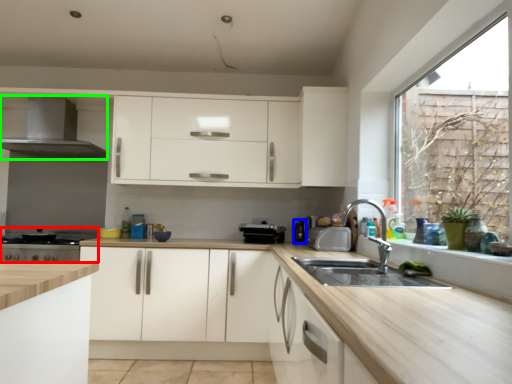
Question: Which object is the closest to the appliance (highlighted by a red box)? Choose among these: appliance (highlighted by a blue box) or exhaust hood (highlighted by a green box).

Choices:
 (A) appliance
 (B) exhaust hood

Answer: (B)